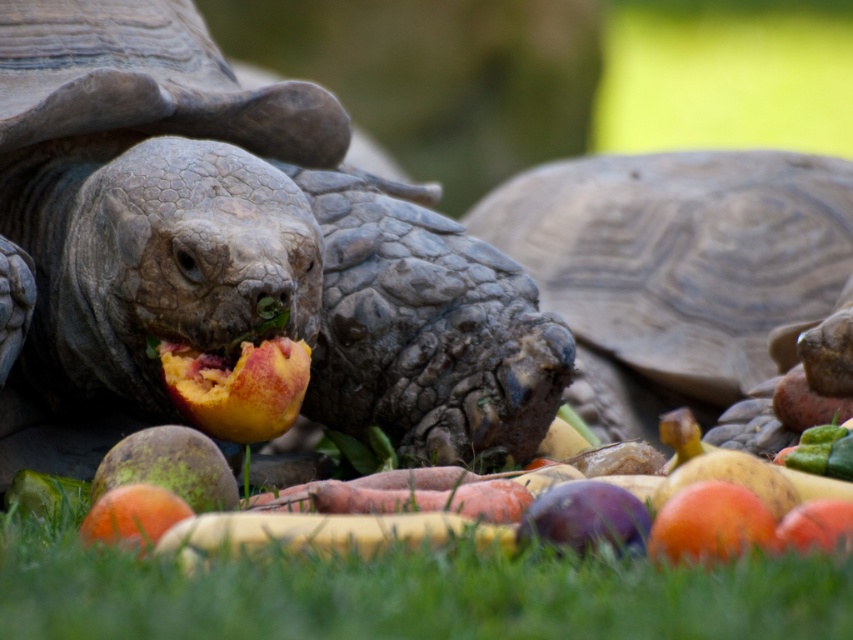
You are a tortoise trying to decide which fruit to eat first. You can choose between the smooth orange mango at center and the orange matte peach at center. Which fruit is wider?

The smooth orange mango at center is wider than the orange matte peach at center.

You are a small robot with a 50 cm arm reach. You need to pick up the ripe peach at center and the smooth orange mango at center. Can you reach both without moving your position?

The ripe peach at center is 75.49 centimeters from the smooth orange mango at center. Since your arm can only reach 50 cm, you cannot reach both without moving your position.